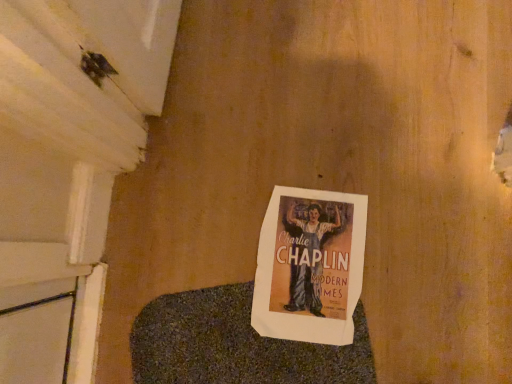
Locate an element on the screen. space that is in front of matte paper poster at center is located at coordinates (342, 356).